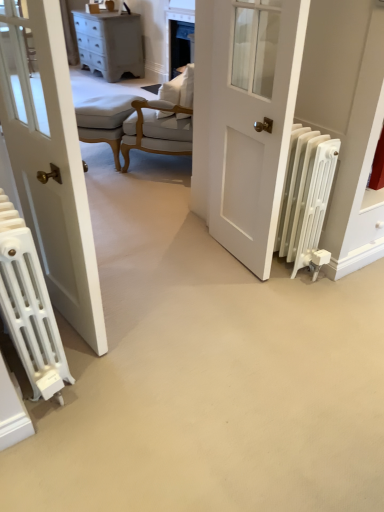
Locate an element on the screen. empty space that is in between white matte door at center and white matte radiator at lower left, acting as the first radiator starting from the left is located at coordinates (165, 300).